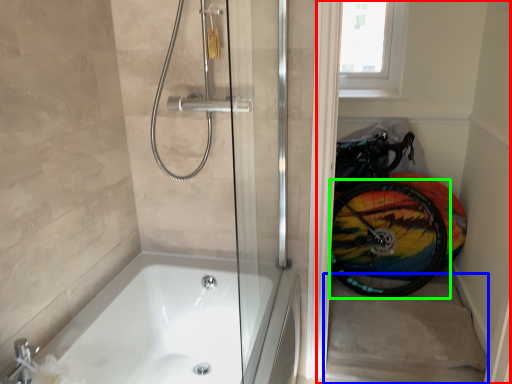
Question: Considering the real-world distances, which object is closest to glass door (highlighted by a red box)? stairwell (highlighted by a blue box) or bicycle wheel (highlighted by a green box).

Choices:
 (A) stairwell
 (B) bicycle wheel

Answer: (B)